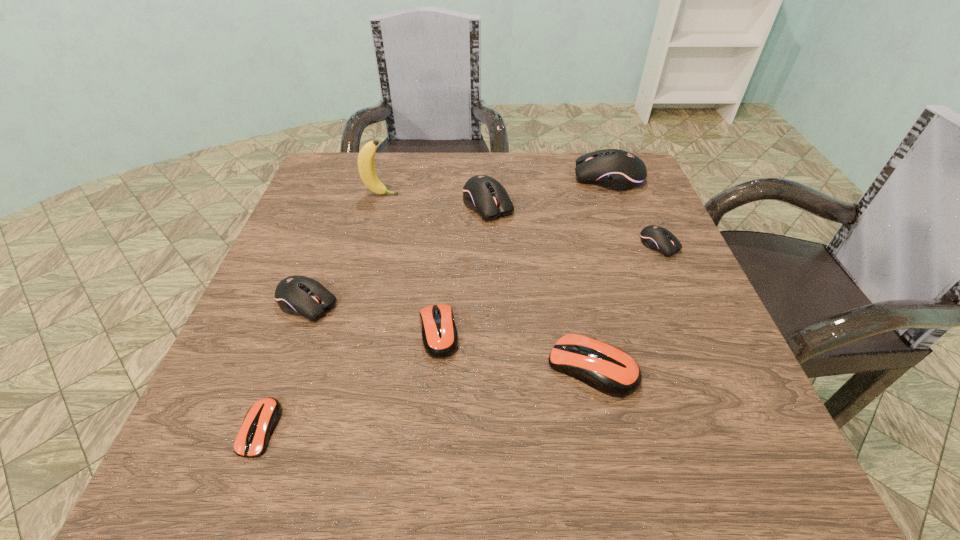
Where is `the second smallest orange computer mouse`? The image size is (960, 540). the second smallest orange computer mouse is located at coordinates (439, 333).

Where is `the nearest object`? Image resolution: width=960 pixels, height=540 pixels. the nearest object is located at coordinates (260, 421).

The height and width of the screenshot is (540, 960). Find the location of `the shortest computer mouse`. the shortest computer mouse is located at coordinates (260, 421).

Identify the location of vacant space located 0.200m from the stem of the tallest object. (479, 195).

You are a GUI agent. You are given a task and a screenshot of the screen. Output one action in this format:
    pyautogui.click(x=<x>, y=<y>)
    Task: Click on the free space located 0.130m on the front of the tallest computer mouse
    
    Given the screenshot: What is the action you would take?
    pyautogui.click(x=626, y=224)

Find the location of `free space located 0.230m on the front of the second tallest computer mouse`. free space located 0.230m on the front of the second tallest computer mouse is located at coordinates [x=490, y=299].

You are a GUI agent. You are given a task and a screenshot of the screen. Output one action in this format:
    pyautogui.click(x=<x>, y=<y>)
    Task: Click on the vacant area located on the back of the fourth tallest object
    
    Given the screenshot: What is the action you would take?
    pyautogui.click(x=324, y=256)

Identify the location of vacant space positioned 0.220m on the back of the rightmost orange computer mouse. (568, 255).

At what (x,y) coordinates should I click in order to perform the action: click on vacant space located 0.240m on the left of the fifth nearest computer mouse. Please return your answer as a coordinate pair (x, y). Looking at the image, I should click on (530, 245).

The height and width of the screenshot is (540, 960). What are the coordinates of `vacant position located 0.170m on the left of the second orange computer mouse from left to right` in the screenshot? It's located at (323, 333).